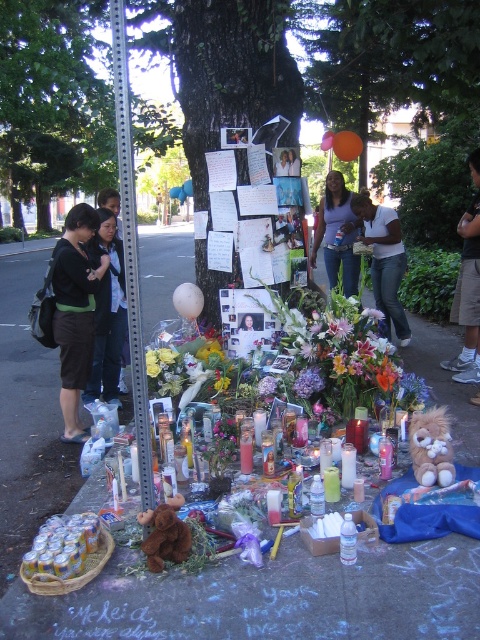
The height and width of the screenshot is (640, 480). What do you see at coordinates (108, 314) in the screenshot? I see `black fabric shirt at left` at bounding box center [108, 314].

Can you confirm if black fabric shirt at left is positioned below purple matte flower at center?

Actually, black fabric shirt at left is above purple matte flower at center.

The image size is (480, 640). I want to click on black fabric shirt at left, so click(x=108, y=314).

Does smooth concrete sidewalk at center have a lesser height compared to matte purple shirt at center?

No, smooth concrete sidewalk at center is not shorter than matte purple shirt at center.

Looking at this image, does smooth concrete sidewalk at center come behind matte purple shirt at center?

No, smooth concrete sidewalk at center is in front of matte purple shirt at center.

I want to click on smooth concrete sidewalk at center, so click(210, 566).

In the scene shown: Is white cotton shirt at center taller than smooth skin face at center?

Correct, white cotton shirt at center is much taller as smooth skin face at center.

Who is more forward, (381,298) or (295,168)?

Point (295,168) is more forward.

The image size is (480, 640). Identify the location of white cotton shirt at center. (384, 260).